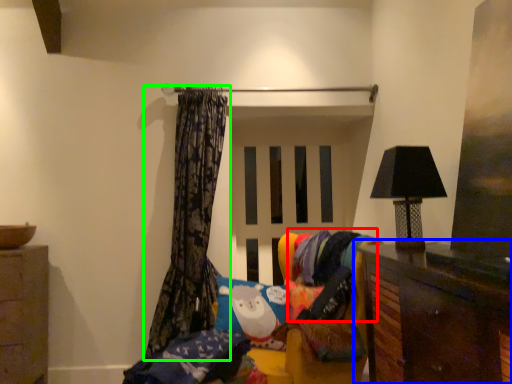
Question: Based on their relative distances, which object is nearer to fabric (highlighted by a red box)? Choose from furniture (highlighted by a blue box) and curtain (highlighted by a green box).

Choices:
 (A) furniture
 (B) curtain

Answer: (B)